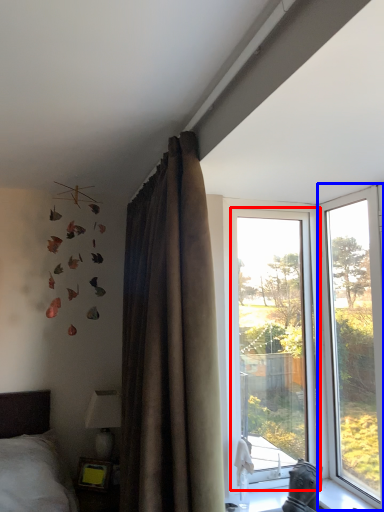
Question: Which point is further to the camera, window (highlighted by a red box) or window (highlighted by a blue box)?

Choices:
 (A) window
 (B) window

Answer: (A)